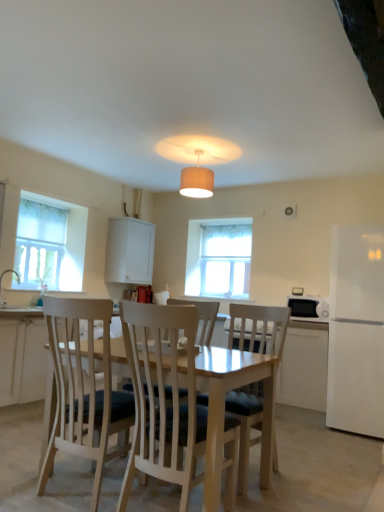
Question: Can you confirm if light wood chair at center, which is the first chair from right to left, is taller than white glossy sink at left?

Choices:
 (A) yes
 (B) no

Answer: (A)

Question: Can you confirm if light wood chair at center, arranged as the 2th chair when viewed from the left, is smaller than white glossy sink at left?

Choices:
 (A) yes
 (B) no

Answer: (B)

Question: Considering the relative sizes of light wood chair at center, which is the first chair from right to left, and white glossy sink at left in the image provided, is light wood chair at center, which is the first chair from right to left, wider than white glossy sink at left?

Choices:
 (A) no
 (B) yes

Answer: (B)

Question: From the image's perspective, does light wood chair at center, arranged as the 2th chair when viewed from the left, appear lower than white glossy sink at left?

Choices:
 (A) no
 (B) yes

Answer: (B)

Question: Can you confirm if light wood chair at center, arranged as the 2th chair when viewed from the left, is shorter than white glossy sink at left?

Choices:
 (A) yes
 (B) no

Answer: (B)

Question: Considering the positions of white fabric lampshade at center and white glossy sink at left in the image, is white fabric lampshade at center wider or thinner than white glossy sink at left?

Choices:
 (A) thin
 (B) wide

Answer: (B)

Question: Looking at the image, does white fabric lampshade at center seem bigger or smaller compared to white glossy sink at left?

Choices:
 (A) small
 (B) big

Answer: (B)

Question: Considering their positions, is white fabric lampshade at center located in front of or behind white glossy sink at left?

Choices:
 (A) front
 (B) behind

Answer: (A)

Question: From a real-world perspective, is white fabric lampshade at center physically located above or below white glossy sink at left?

Choices:
 (A) above
 (B) below

Answer: (A)

Question: Is white wood chair at center, which is the second chair from right to left, wider or thinner than white textured window at center, the 1th window positioned from the right?

Choices:
 (A) wide
 (B) thin

Answer: (A)

Question: Looking at the image, does white wood chair at center, which is the second chair from right to left, seem bigger or smaller compared to white textured window at center, which is counted as the 2th window, starting from the front?

Choices:
 (A) big
 (B) small

Answer: (A)

Question: From the image's perspective, is white wood chair at center, the first chair in the left-to-right sequence, located above or below white textured window at center, which is counted as the 2th window, starting from the front?

Choices:
 (A) above
 (B) below

Answer: (B)

Question: Is point (198, 477) closer or farther from the camera than point (233, 275)?

Choices:
 (A) farther
 (B) closer

Answer: (B)

Question: Is white matte cabinet at upper center taller or shorter than light wood chair at center, which is the first chair from right to left?

Choices:
 (A) short
 (B) tall

Answer: (A)

Question: Considering the positions of point (115, 264) and point (230, 327), is point (115, 264) closer or farther from the camera than point (230, 327)?

Choices:
 (A) closer
 (B) farther

Answer: (B)